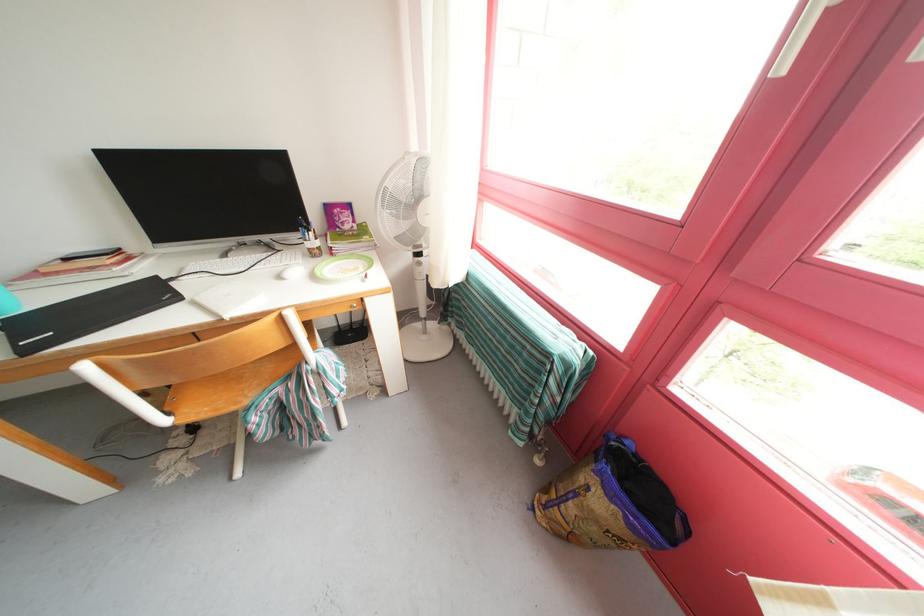
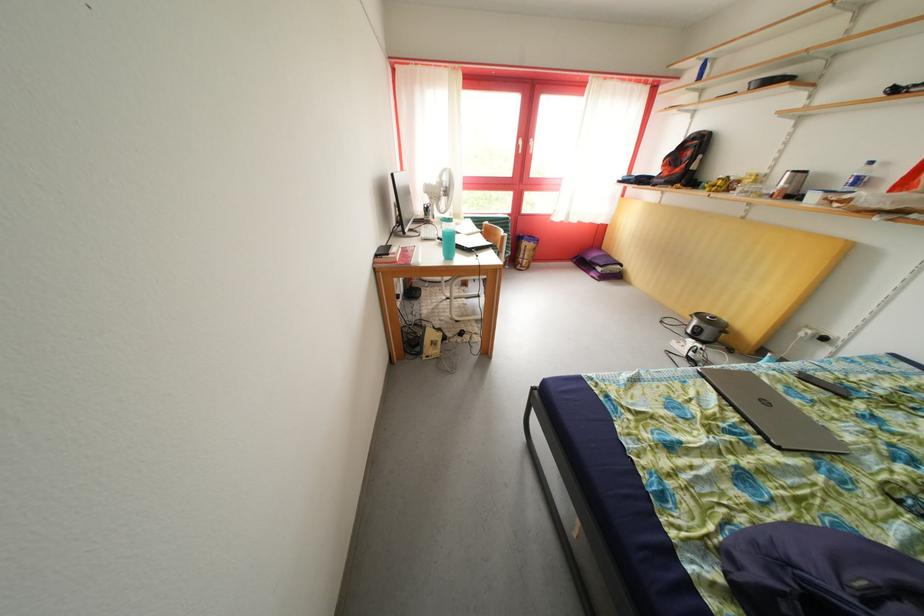
Question: I am providing you with two images of the same scene from different viewpoints. After the viewpoint changes to image2, which objects are now occluded?

Choices:
 (A) small white lid
 (B) plastic water bottle
 (C) white door handle
 (D) pen

Answer: (D)